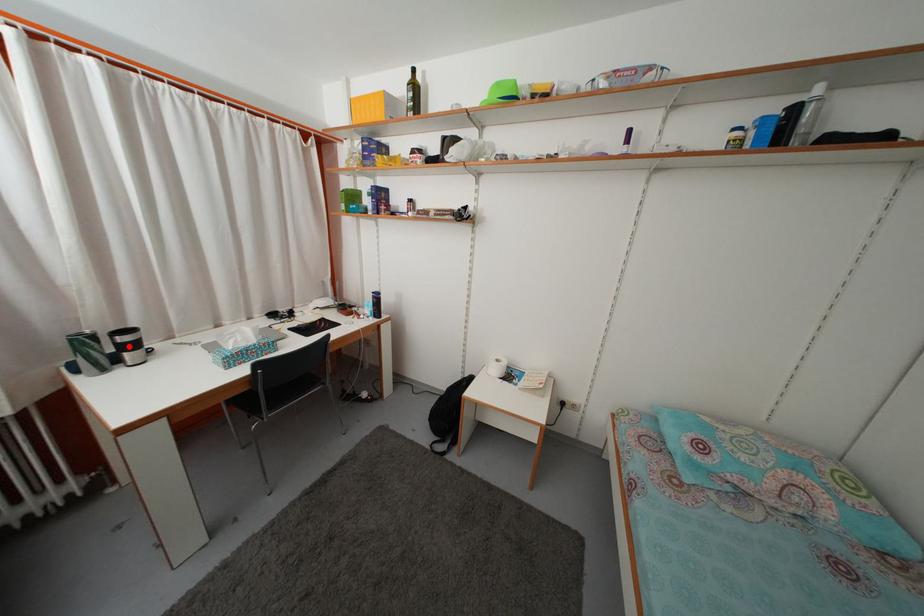
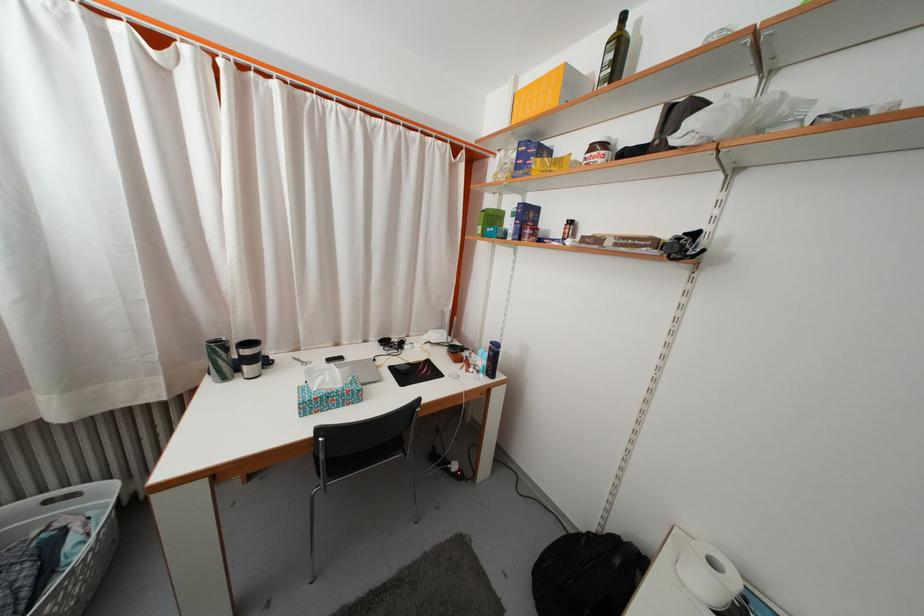
Locate, in the second image, the point that corresponds to the highlighted location in the first image.

(251, 359)